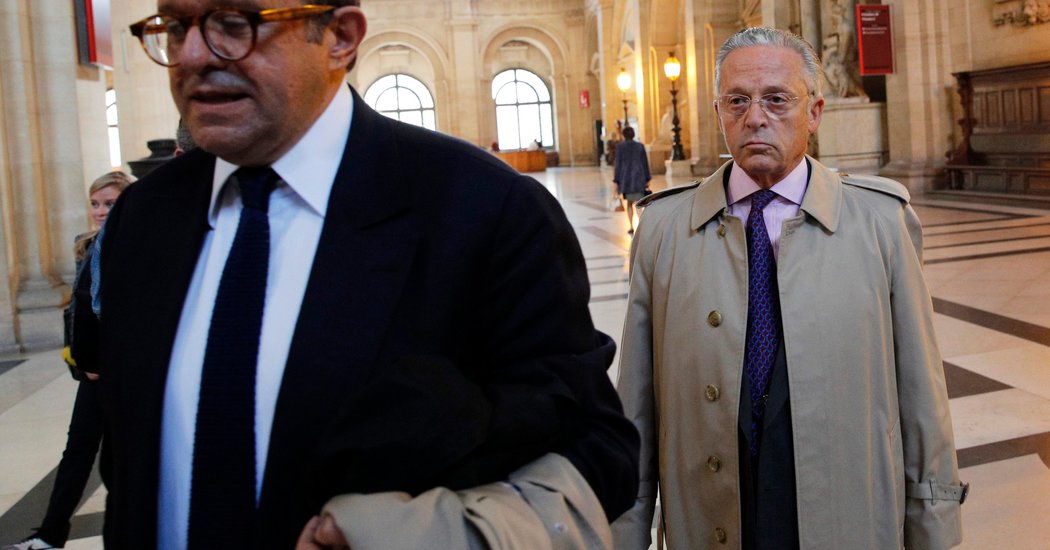
The width and height of the screenshot is (1050, 550). Identify the location of tiled floor. (999, 350).